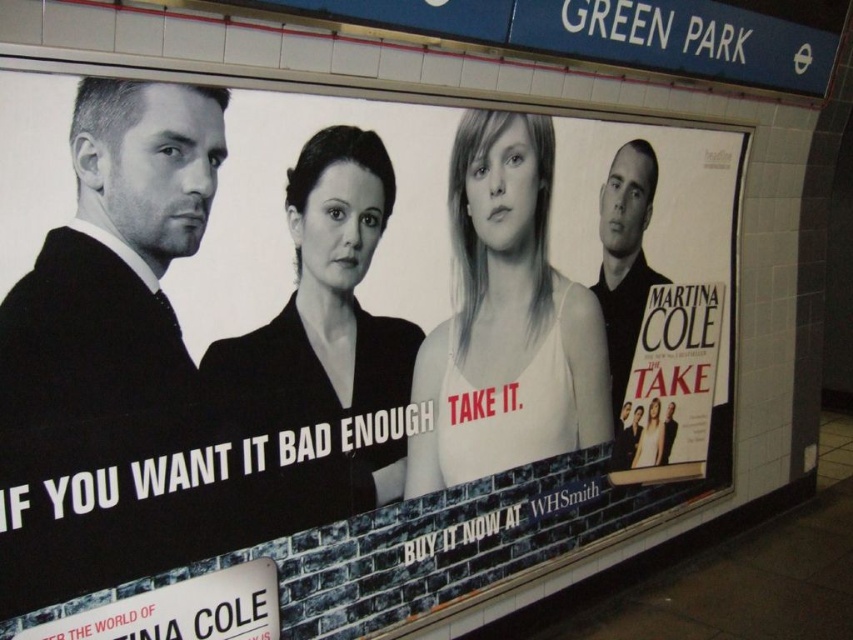
Question: Based on their relative distances, which object is farther from the black matte shirt at right?

Choices:
 (A) black matte dress at center
 (B) hardcover book at right

Answer: (A)

Question: Is white matte tank top at center wider than smooth white tank top at center?

Choices:
 (A) yes
 (B) no

Answer: (A)

Question: Which point appears closest to the camera in this image?

Choices:
 (A) (670, 429)
 (B) (312, 250)
 (C) (457, 330)
 (D) (657, 440)

Answer: (B)

Question: Does black matte shirt at right appear on the right side of smooth white tank top at center?

Choices:
 (A) no
 (B) yes

Answer: (A)

Question: Based on their relative distances, which object is nearer to the black matte dress at center?

Choices:
 (A) black matte shirt at right
 (B) smooth white tank top at center
 (C) hardcover book at right
 (D) white matte tank top at center

Answer: (D)

Question: Where is black matte dress at center located in relation to smooth white tank top at center in the image?

Choices:
 (A) below
 (B) above

Answer: (B)